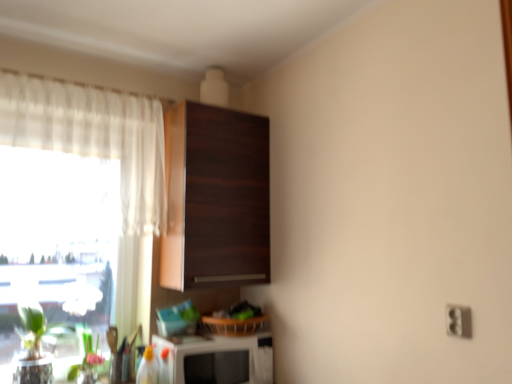
The width and height of the screenshot is (512, 384). What do you see at coordinates (94, 137) in the screenshot? I see `white sheer curtain at left` at bounding box center [94, 137].

Identify the location of dark wood cabinet at upper center. (215, 198).

Find the location of `green matte plant at lower left`. green matte plant at lower left is located at coordinates (86, 358).

Does dark wood cabinet at upper center appear on the left side of white sheer curtain at left?

No.

Is dark wood cabinet at upper center wider than white sheer curtain at left?

Yes.

From a real-world perspective, is dark wood cabinet at upper center under white plastic electric outlet at lower right?

No.

From the picture: In terms of height, does dark wood cabinet at upper center look taller or shorter compared to white plastic electric outlet at lower right?

In the image, dark wood cabinet at upper center appears to be taller than white plastic electric outlet at lower right.

Is dark wood cabinet at upper center wider than white plastic electric outlet at lower right?

Indeed, dark wood cabinet at upper center has a greater width compared to white plastic electric outlet at lower right.

From the image's perspective, is green matte plant at lower left above or below white glossy microwave at lower center?

green matte plant at lower left is above white glossy microwave at lower center.

From the picture: Which object is closer to the camera, green matte plant at lower left or white glossy microwave at lower center?

white glossy microwave at lower center is closer to the camera.

Find the location of a particular element. appliance below the green matte plant at lower left (from the image's perspective) is located at coordinates tap(215, 359).

From a real-world perspective, between green matte plant at lower left and white plastic electric outlet at lower right, who is vertically lower?

green matte plant at lower left.

Looking at the image, does green matte plant at lower left seem bigger or smaller compared to white plastic electric outlet at lower right?

Considering their sizes, green matte plant at lower left takes up more space than white plastic electric outlet at lower right.

Locate an element on the screen. This screenshot has height=384, width=512. plant below the white plastic electric outlet at lower right (from the image's perspective) is located at coordinates (86, 358).

From the image's perspective, which one is positioned higher, green matte plant at lower left or white plastic electric outlet at lower right?

white plastic electric outlet at lower right appears higher in the image.

Can you confirm if white glossy microwave at lower center is thinner than white sheer curtain at left?

In fact, white glossy microwave at lower center might be wider than white sheer curtain at left.

Looking at this image, is white glossy microwave at lower center turned away from white sheer curtain at left?

No, white glossy microwave at lower center's orientation is not away from white sheer curtain at left.

From a real-world perspective, between white glossy microwave at lower center and white sheer curtain at left, who is vertically higher?

In real-world perspective, white sheer curtain at left is above.

Is white sheer curtain at left surrounded by white glossy microwave at lower center?

No.

Does green matte plant at lower left appear on the right side of white sheer curtain at left?

No, green matte plant at lower left is not to the right of white sheer curtain at left.

Could you tell me if green matte plant at lower left is facing white sheer curtain at left?

No, green matte plant at lower left is not oriented towards white sheer curtain at left.

Between green matte plant at lower left and white sheer curtain at left, which one has larger size?

Answer: white sheer curtain at left.

Considering the sizes of objects green matte plant at lower left and white sheer curtain at left in the image provided, who is taller, green matte plant at lower left or white sheer curtain at left?

Standing taller between the two is white sheer curtain at left.

Considering the positions of objects green matte plant at lower left and dark wood cabinet at upper center in the image provided, who is more to the right, green matte plant at lower left or dark wood cabinet at upper center?

dark wood cabinet at upper center is more to the right.

Consider the image. Considering the sizes of objects green matte plant at lower left and dark wood cabinet at upper center in the image provided, who is taller, green matte plant at lower left or dark wood cabinet at upper center?

dark wood cabinet at upper center is taller.

You are a GUI agent. You are given a task and a screenshot of the screen. Output one action in this format:
    pyautogui.click(x=<x>, y=<y>)
    Task: Click on the cabinetry in front of the green matte plant at lower left
    The width and height of the screenshot is (512, 384).
    Given the screenshot: What is the action you would take?
    pyautogui.click(x=215, y=198)

From the image's perspective, is green matte plant at lower left under dark wood cabinet at upper center?

Yes, from the image's perspective, green matte plant at lower left is beneath dark wood cabinet at upper center.

This screenshot has width=512, height=384. Find the location of `cabinetry on the right of white sheer curtain at left`. cabinetry on the right of white sheer curtain at left is located at coordinates (215, 198).

Locate an element on the screen. electric outlet in front of the dark wood cabinet at upper center is located at coordinates (458, 321).

Looking at this image, looking at the image, which one is located closer to white plastic electric outlet at lower right, white sheer curtain at left or white glossy microwave at lower center?

white glossy microwave at lower center is positioned closer to the anchor white plastic electric outlet at lower right.

Looking at the image, which one is located further to white sheer curtain at left, white glossy microwave at lower center or dark wood cabinet at upper center?

Among the two, white glossy microwave at lower center is located further to white sheer curtain at left.

Looking at the image, which one is located further to dark wood cabinet at upper center, green matte plant at lower left or white sheer curtain at left?

green matte plant at lower left is positioned further to the anchor dark wood cabinet at upper center.

From the image, which object appears to be nearer to white plastic electric outlet at lower right, white glossy microwave at lower center or dark wood cabinet at upper center?

The object closer to white plastic electric outlet at lower right is white glossy microwave at lower center.

Based on their spatial positions, is white sheer curtain at left or dark wood cabinet at upper center closer to white glossy microwave at lower center?

dark wood cabinet at upper center.

From the image, which object appears to be nearer to white glossy microwave at lower center, dark wood cabinet at upper center or white sheer curtain at left?

Based on the image, dark wood cabinet at upper center appears to be nearer to white glossy microwave at lower center.

Looking at the image, which one is located closer to white sheer curtain at left, white plastic electric outlet at lower right or green matte plant at lower left?

The object closer to white sheer curtain at left is green matte plant at lower left.

Based on their spatial positions, is white sheer curtain at left or white plastic electric outlet at lower right further from green matte plant at lower left?

Among the two, white plastic electric outlet at lower right is located further to green matte plant at lower left.

You are a GUI agent. You are given a task and a screenshot of the screen. Output one action in this format:
    pyautogui.click(x=<x>, y=<y>)
    Task: Click on the appliance between white sheer curtain at left and white plastic electric outlet at lower right
    The width and height of the screenshot is (512, 384).
    Given the screenshot: What is the action you would take?
    tap(215, 359)

The height and width of the screenshot is (384, 512). What are the coordinates of `plant between white sheer curtain at left and white glossy microwave at lower center in the vertical direction` in the screenshot? It's located at (86, 358).

Locate an element on the screen. cabinetry that lies between white sheer curtain at left and white glossy microwave at lower center from top to bottom is located at coordinates (215, 198).

Identify the location of appliance between green matte plant at lower left and white plastic electric outlet at lower right from left to right. (215, 359).